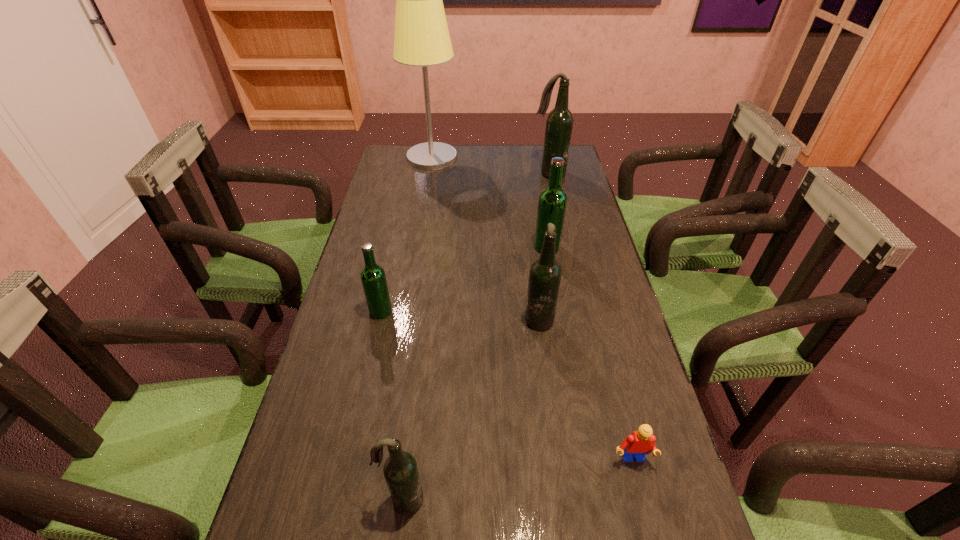
I want to click on free space between the table lamp and the nearest dark beer bottle, so click(417, 328).

This screenshot has width=960, height=540. Find the location of `free area in between the tallest object and the bigger green beer bottle`. free area in between the tallest object and the bigger green beer bottle is located at coordinates (490, 202).

Identify the location of free space between the sixth farthest object and the farthest dark beer bottle. (589, 317).

At what (x,y) coordinates should I click in order to perform the action: click on free space between the smaller green beer bottle and the second nearest object. Please return your answer as a coordinate pair (x, y). This screenshot has height=540, width=960. Looking at the image, I should click on (506, 386).

This screenshot has height=540, width=960. In order to click on free point between the red Lego and the farther green beer bottle in this screenshot , I will do `click(589, 354)`.

Point out which object is positioned as the second nearest to the shortest object. Please provide its 2D coordinates. Your answer should be formatted as a tuple, i.e. [(x, y)], where the tuple contains the x and y coordinates of a point satisfying the conditions above.

[(401, 474)]

Locate which object ranks fifth in proximity to the nearer green beer bottle. Please provide its 2D coordinates. Your answer should be formatted as a tuple, i.e. [(x, y)], where the tuple contains the x and y coordinates of a point satisfying the conditions above.

[(422, 38)]

Select which beer bottle appears as the second closest to the left green beer bottle. Please provide its 2D coordinates. Your answer should be formatted as a tuple, i.e. [(x, y)], where the tuple contains the x and y coordinates of a point satisfying the conditions above.

[(401, 474)]

Select which beer bottle is the fourth closest to the bigger green beer bottle. Please provide its 2D coordinates. Your answer should be formatted as a tuple, i.e. [(x, y)], where the tuple contains the x and y coordinates of a point satisfying the conditions above.

[(401, 474)]

Identify which dark beer bottle is the third nearest to the red Lego. Please provide its 2D coordinates. Your answer should be formatted as a tuple, i.e. [(x, y)], where the tuple contains the x and y coordinates of a point satisfying the conditions above.

[(559, 123)]